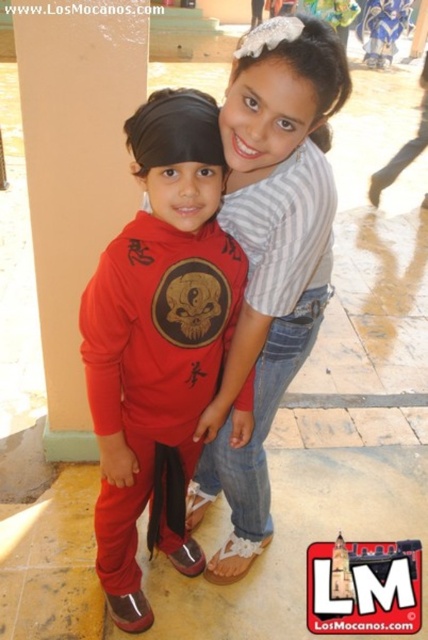
You are a photographer setting up for an outdoor event. You need to position a camera so that both the striped cotton shirt at upper center and the matte beige pillar at left are in frame. Given their distance apart, can you estimate if a standard 50mm lens will capture both objects in the same shot?

The striped cotton shirt at upper center is 28.49 inches from the matte beige pillar at left. A standard 50mm lens has a field of view that can typically capture objects within this distance range when focused at an appropriate distance, so yes, both objects should be in frame.

You are a photographer trying to capture a clear shot of the matte red ninja suit at center. Based on the coordinates provided, where should you aim your camera to ensure the suit is centered in your frame?

The matte red ninja suit at center is located at coordinates point (157, 340), so you should aim your camera at that exact point to center the suit in your frame.